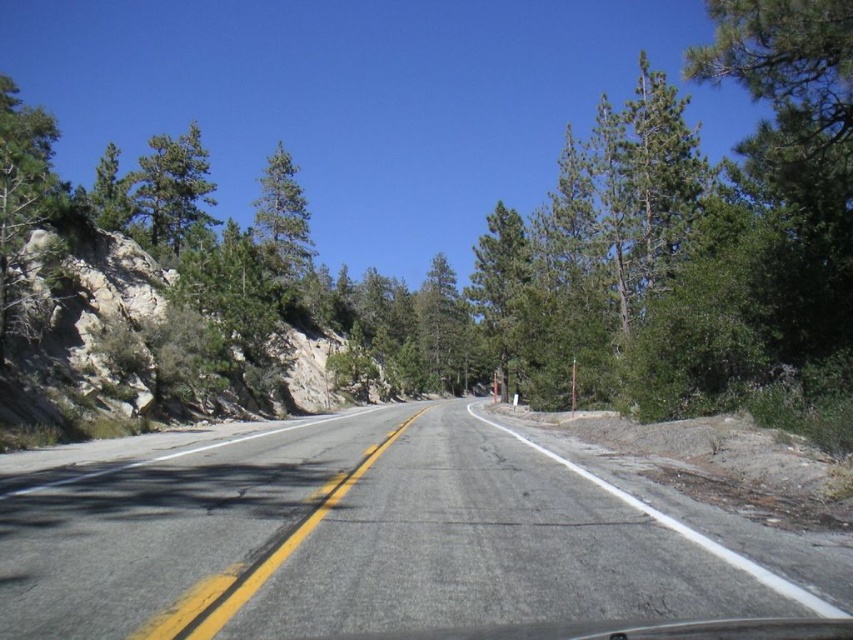
Does asphalt road at center appear over green matte tree at upper center?

No, asphalt road at center is not above green matte tree at upper center.

Identify the location of asphalt road at center. This screenshot has height=640, width=853. (376, 536).

Can you confirm if green matte tree at upper left is shorter than green matte tree at upper center?

No, green matte tree at upper left is not shorter than green matte tree at upper center.

Is point (164, 253) positioned after point (264, 188)?

No, it is not.

Identify the location of green matte tree at upper left. 171,189.

Does asphalt road at center appear under green matte tree at upper left?

Yes, asphalt road at center is below green matte tree at upper left.

Does asphalt road at center lie in front of green matte tree at upper left?

That is True.

Image resolution: width=853 pixels, height=640 pixels. What do you see at coordinates (376, 536) in the screenshot? I see `asphalt road at center` at bounding box center [376, 536].

Where is `asphalt road at center`? asphalt road at center is located at coordinates coord(376,536).